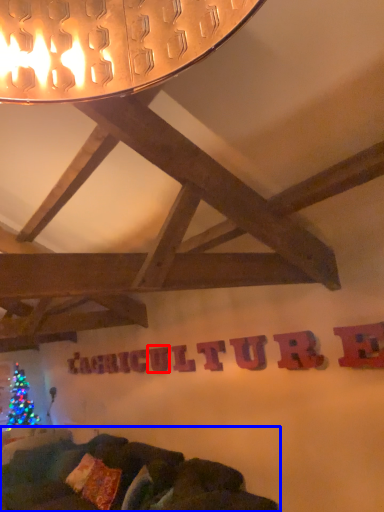
Question: Among these objects, which one is farthest to the camera, letter (highlighted by a red box) or studio couch (highlighted by a blue box)?

Choices:
 (A) letter
 (B) studio couch

Answer: (A)